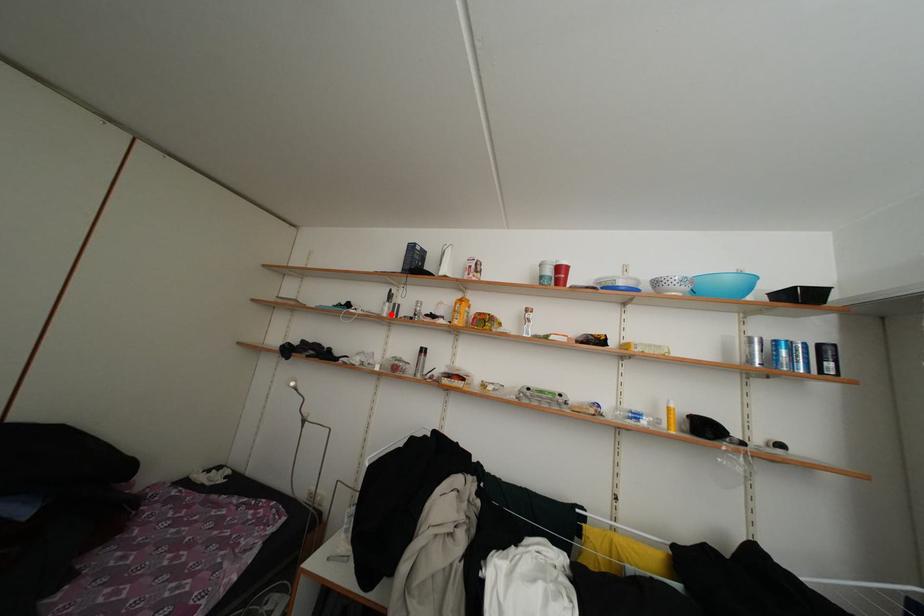
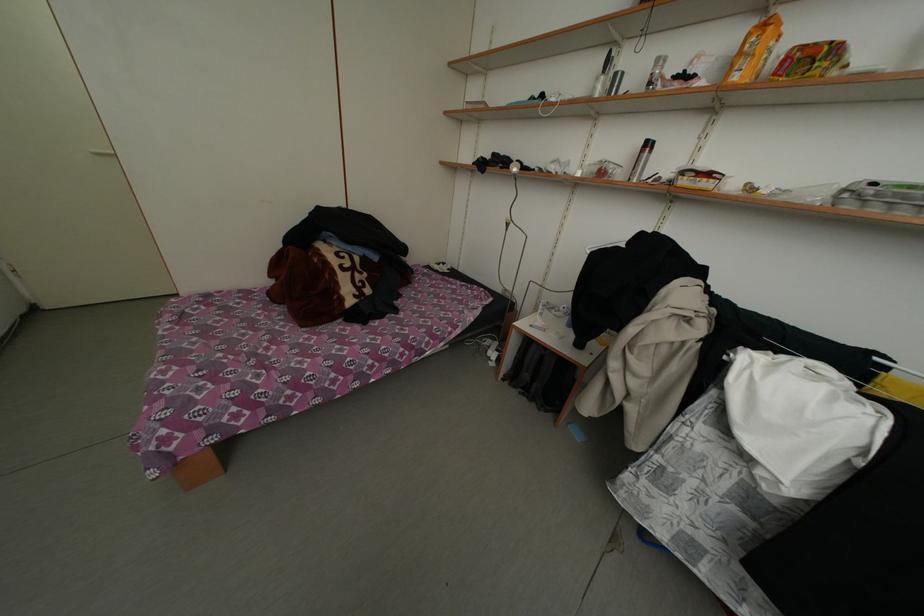
Find the pixel in the second image that matches the highlighted location in the first image.

(602, 94)